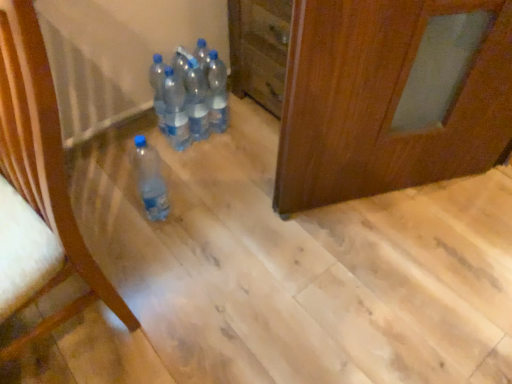
Question: From the image's perspective, would you say translucent plastic bottles at center, placed as the fourth bottle when sorted from left to right, is positioned over transparent plastic bottles at center, placed as the 5th bottle when sorted from left to right?

Choices:
 (A) no
 (B) yes

Answer: (A)

Question: Can you confirm if translucent plastic bottles at center, placed as the fourth bottle when sorted from left to right, is wider than transparent plastic bottles at center, placed as the 5th bottle when sorted from left to right?

Choices:
 (A) no
 (B) yes

Answer: (A)

Question: Is there a large distance between translucent plastic bottles at center, placed as the fourth bottle when sorted from left to right, and transparent plastic bottles at center, the first bottle positioned from the right?

Choices:
 (A) no
 (B) yes

Answer: (A)

Question: From a real-world perspective, does translucent plastic bottles at center, placed as the 2th bottle when sorted from right to left, sit lower than transparent plastic bottles at center, the first bottle positioned from the right?

Choices:
 (A) yes
 (B) no

Answer: (B)

Question: Is translucent plastic bottles at center, placed as the 2th bottle when sorted from right to left, bigger than transparent plastic bottles at center, the first bottle positioned from the right?

Choices:
 (A) no
 (B) yes

Answer: (A)

Question: Does translucent plastic bottles at center, placed as the 2th bottle when sorted from right to left, have a lesser width compared to transparent plastic bottles at center, the first bottle positioned from the right?

Choices:
 (A) yes
 (B) no

Answer: (A)

Question: From the image's perspective, is transparent plastic bottles at center, the 5th bottle when ordered from right to left, above transparent plastic bottles at center, the first bottle positioned from the right?

Choices:
 (A) yes
 (B) no

Answer: (B)

Question: Is transparent plastic bottles at center, which appears as the 1th bottle when viewed from the left, at the left side of transparent plastic bottles at center, placed as the 5th bottle when sorted from left to right?

Choices:
 (A) no
 (B) yes

Answer: (B)

Question: Considering the relative positions of transparent plastic bottles at center, the 5th bottle when ordered from right to left, and transparent plastic bottles at center, placed as the 5th bottle when sorted from left to right, in the image provided, is transparent plastic bottles at center, the 5th bottle when ordered from right to left, to the right of transparent plastic bottles at center, placed as the 5th bottle when sorted from left to right, from the viewer's perspective?

Choices:
 (A) no
 (B) yes

Answer: (A)

Question: Can you confirm if transparent plastic bottles at center, the 5th bottle when ordered from right to left, is wider than transparent plastic bottles at center, the first bottle positioned from the right?

Choices:
 (A) yes
 (B) no

Answer: (B)

Question: Considering the relative sizes of transparent plastic bottles at center, which appears as the 1th bottle when viewed from the left, and transparent plastic bottles at center, the first bottle positioned from the right, in the image provided, is transparent plastic bottles at center, which appears as the 1th bottle when viewed from the left, shorter than transparent plastic bottles at center, the first bottle positioned from the right,?

Choices:
 (A) yes
 (B) no

Answer: (A)

Question: Is transparent plastic bottles at center, which appears as the 1th bottle when viewed from the left, beside transparent plastic bottles at center, the first bottle positioned from the right?

Choices:
 (A) no
 (B) yes

Answer: (A)

Question: Is translucent plastic bottle at lower left, acting as the 4th bottle starting from the right, closer to the viewer compared to translucent plastic bottles at center, placed as the fourth bottle when sorted from left to right?

Choices:
 (A) no
 (B) yes

Answer: (B)